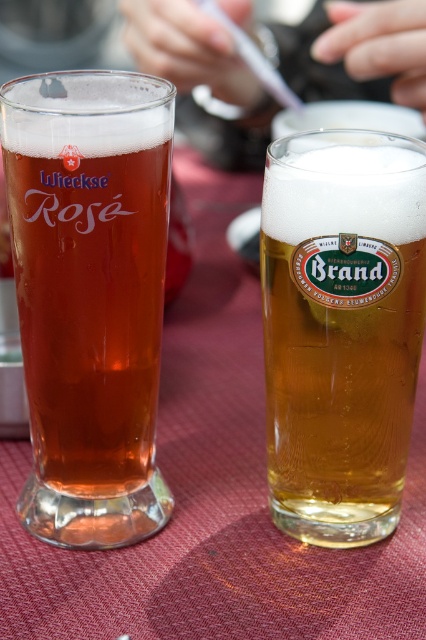
Between matte glass at left and golden glass beer at center, which one is positioned lower?

golden glass beer at center is below.

Find the location of a particular element. This screenshot has width=426, height=640. matte glass at left is located at coordinates (89, 296).